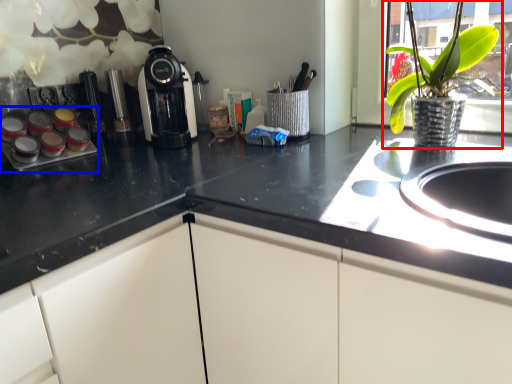
Question: Which of the following is the farthest to the observer, houseplant (highlighted by a red box) or appliance (highlighted by a blue box)?

Choices:
 (A) houseplant
 (B) appliance

Answer: (B)